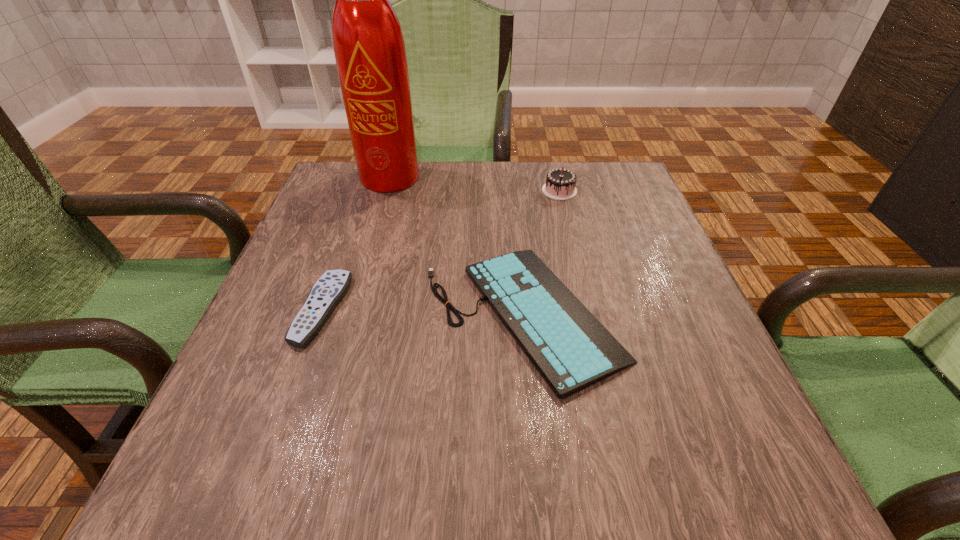
Where is `free space between the tallest object and the second tallest object`? The width and height of the screenshot is (960, 540). free space between the tallest object and the second tallest object is located at coordinates (477, 184).

Find the location of `object that ranks as the third closest to the chocolate cake`. object that ranks as the third closest to the chocolate cake is located at coordinates (330, 288).

Choose which object is the third nearest neighbor to the tallest object. Please provide its 2D coordinates. Your answer should be formatted as a tuple, i.e. [(x, y)], where the tuple contains the x and y coordinates of a point satisfying the conditions above.

[(330, 288)]

Locate an element on the screen. free space that satisfies the following two spatial constraints: 1. on the front side of the chocolate cake; 2. on the left side of the fire extinguisher is located at coordinates (391, 191).

You are a GUI agent. You are given a task and a screenshot of the screen. Output one action in this format:
    pyautogui.click(x=<x>, y=<y>)
    Task: Click on the blank area in the image that satisfies the following two spatial constraints: 1. on the back side of the remote control; 2. on the left side of the second tallest object
    Image resolution: width=960 pixels, height=540 pixels.
    Given the screenshot: What is the action you would take?
    pyautogui.click(x=365, y=191)

Where is `vacant region that satisfies the following two spatial constraints: 1. on the back side of the chocolate cake; 2. on the right side of the remote control`? This screenshot has width=960, height=540. vacant region that satisfies the following two spatial constraints: 1. on the back side of the chocolate cake; 2. on the right side of the remote control is located at coordinates (365, 191).